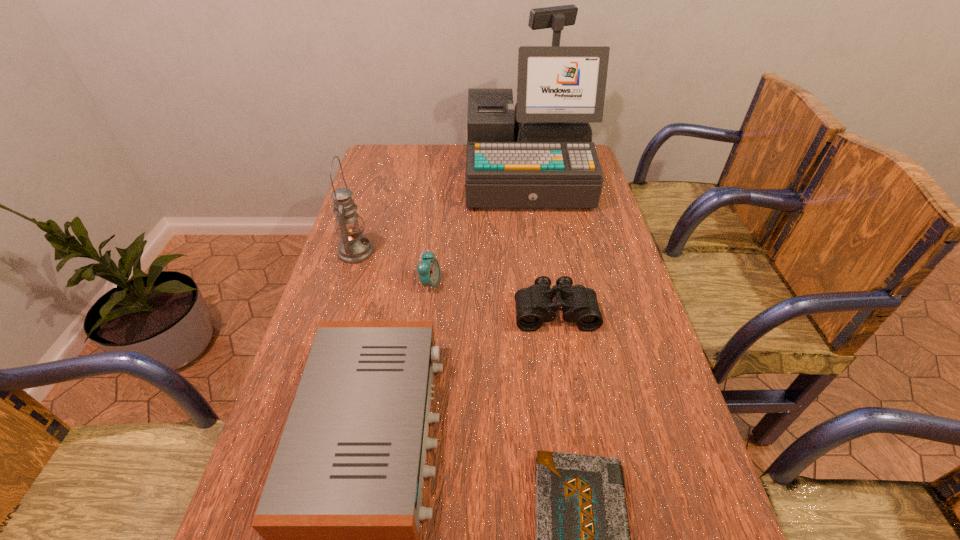
Where is `object located in the far edge section of the desktop`? This screenshot has width=960, height=540. object located in the far edge section of the desktop is located at coordinates (540, 154).

You are a GUI agent. You are given a task and a screenshot of the screen. Output one action in this format:
    pyautogui.click(x=<x>, y=<y>)
    Task: Click on the object that is at the left edge
    This screenshot has height=540, width=960.
    Given the screenshot: What is the action you would take?
    pyautogui.click(x=353, y=248)

You are a GUI agent. You are given a task and a screenshot of the screen. Output one action in this format:
    pyautogui.click(x=<x>, y=<y>)
    Task: Click on the cash register located in the right edge section of the desktop
    The width and height of the screenshot is (960, 540).
    Given the screenshot: What is the action you would take?
    pyautogui.click(x=540, y=154)

Identify the location of binoculars present at the right edge. coord(534,305).

The image size is (960, 540). I want to click on object that is at the far right corner, so [540, 154].

In the image, there is a desktop. At what (x,y) coordinates should I click in order to perform the action: click on vacant space at the far edge. Please return your answer as a coordinate pair (x, y). The width and height of the screenshot is (960, 540). Looking at the image, I should click on (446, 161).

Identify the location of vacant space at the left edge. Image resolution: width=960 pixels, height=540 pixels. (304, 355).

At what (x,y) coordinates should I click in order to perform the action: click on vacant space at the right edge of the desktop. Please return your answer as a coordinate pair (x, y). The height and width of the screenshot is (540, 960). Looking at the image, I should click on (600, 244).

This screenshot has height=540, width=960. Find the location of `free region at the far left corner`. free region at the far left corner is located at coordinates (387, 163).

Where is `empty space that is in between the alarm clock and the cash register`? empty space that is in between the alarm clock and the cash register is located at coordinates (478, 230).